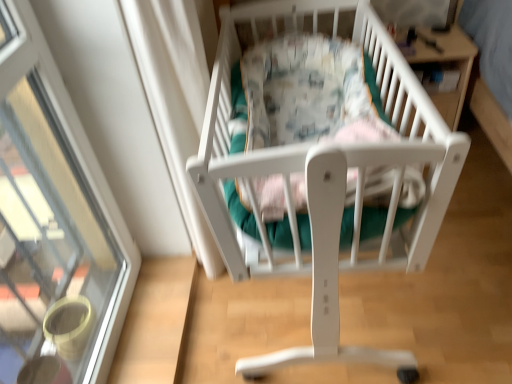
Question: From the image's perspective, is white matte infant bed at center beneath transparent glass door at upper left?

Choices:
 (A) no
 (B) yes

Answer: (A)

Question: Does white matte infant bed at center have a lesser width compared to transparent glass door at upper left?

Choices:
 (A) no
 (B) yes

Answer: (A)

Question: From the image's perspective, is white matte infant bed at center above transparent glass door at upper left?

Choices:
 (A) yes
 (B) no

Answer: (A)

Question: Is white matte infant bed at center positioned before transparent glass door at upper left?

Choices:
 (A) no
 (B) yes

Answer: (A)

Question: From a real-world perspective, is white matte infant bed at center under transparent glass door at upper left?

Choices:
 (A) no
 (B) yes

Answer: (B)

Question: In terms of width, does white matte infant bed at center look wider or thinner when compared to transparent glass door at upper left?

Choices:
 (A) thin
 (B) wide

Answer: (B)

Question: Is white matte infant bed at center taller or shorter than transparent glass door at upper left?

Choices:
 (A) tall
 (B) short

Answer: (B)

Question: From a real-world perspective, is white matte infant bed at center above or below transparent glass door at upper left?

Choices:
 (A) below
 (B) above

Answer: (A)

Question: Choose the correct answer: Is white matte infant bed at center inside transparent glass door at upper left or outside it?

Choices:
 (A) outside
 (B) inside

Answer: (A)

Question: From the image's perspective, is transparent glass door at upper left positioned above or below white matte infant bed at center?

Choices:
 (A) below
 (B) above

Answer: (A)

Question: Is point click(x=76, y=243) closer or farther from the camera than point click(x=285, y=34)?

Choices:
 (A) farther
 (B) closer

Answer: (B)

Question: Is transparent glass door at upper left spatially inside white matte infant bed at center, or outside of it?

Choices:
 (A) outside
 (B) inside

Answer: (A)

Question: In terms of height, does transparent glass door at upper left look taller or shorter compared to white matte infant bed at center?

Choices:
 (A) short
 (B) tall

Answer: (B)

Question: Is transparent glass door at upper left in front of or behind wooden table at upper right in the image?

Choices:
 (A) front
 (B) behind

Answer: (A)

Question: Is transparent glass door at upper left bigger or smaller than wooden table at upper right?

Choices:
 (A) big
 (B) small

Answer: (A)